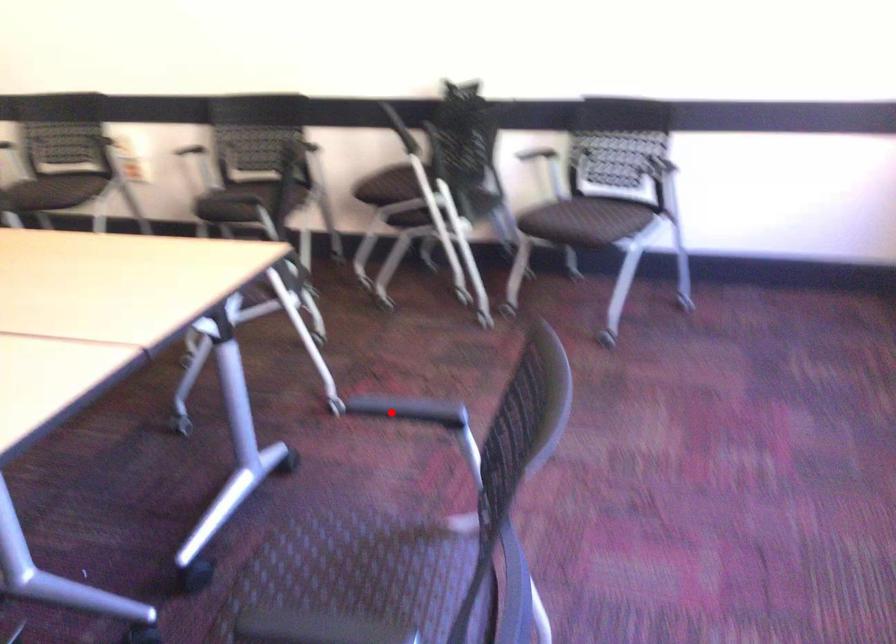
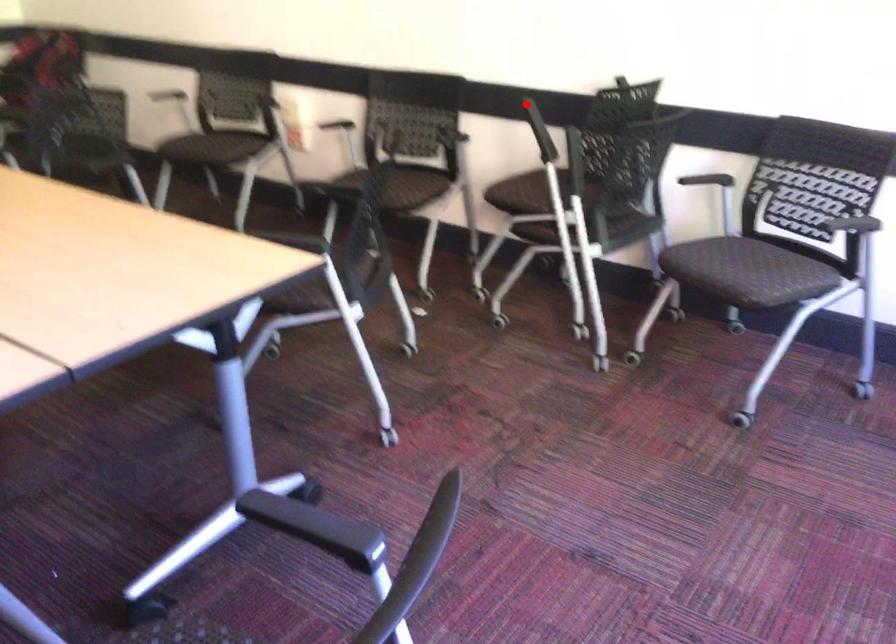
I am providing you with two images of the same scene from different viewpoints. A red point is marked on the first image and another point is marked on the second image. Do the highlighted points in image1 and image2 indicate the same real-world spot?

No